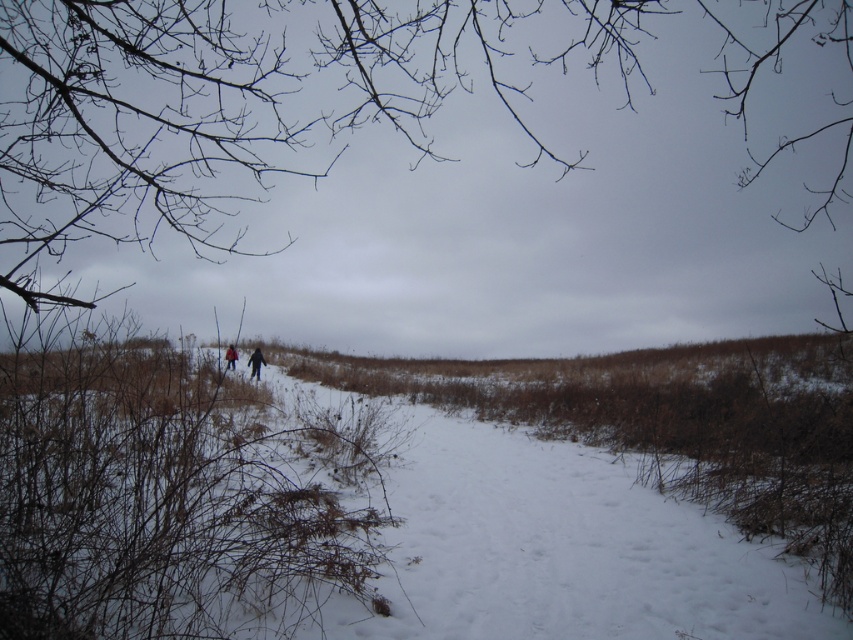
Is white powdery snow at center above dark blue jacket at center?

No, white powdery snow at center is not above dark blue jacket at center.

Can you confirm if white powdery snow at center is wider than dark blue jacket at center?

Yes.

At what (x,y) coordinates should I click in order to perform the action: click on white powdery snow at center. Please return your answer as a coordinate pair (x, y). Image resolution: width=853 pixels, height=640 pixels. Looking at the image, I should click on (338, 516).

Can you confirm if snowy winter coat at center is shorter than dark blue jacket at center?

In fact, snowy winter coat at center may be taller than dark blue jacket at center.

Does point (248, 362) come farther from viewer compared to point (236, 355)?

Yes, point (248, 362) is behind point (236, 355).

Locate an element on the screen. The width and height of the screenshot is (853, 640). snowy winter coat at center is located at coordinates (254, 362).

Between point (28, 554) and point (253, 358), which one is positioned in front?

Point (28, 554)

Is white powdery snow at center above snowy winter coat at center?

No, white powdery snow at center is not above snowy winter coat at center.

You are a GUI agent. You are given a task and a screenshot of the screen. Output one action in this format:
    pyautogui.click(x=<x>, y=<y>)
    Task: Click on the white powdery snow at center
    This screenshot has width=853, height=640.
    Given the screenshot: What is the action you would take?
    pyautogui.click(x=338, y=516)